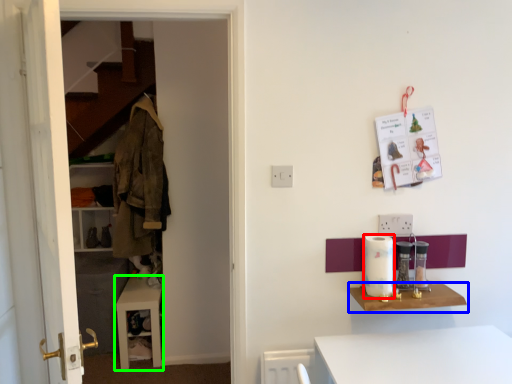
Question: Which object is the farthest from appliance (highlighted by a red box)? Choose among these: shelf (highlighted by a blue box) or table (highlighted by a green box).

Choices:
 (A) shelf
 (B) table

Answer: (B)